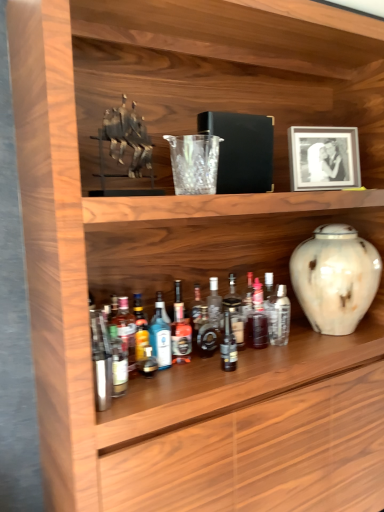
Question: In which direction should I rotate to look at translucent glass bottle at center, the 1th bottle when ordered from left to right?

Choices:
 (A) right
 (B) left

Answer: (B)

Question: Is the depth of white marbled vase at right greater than that of translucent glass bottle at center, placed as the 5th bottle when sorted from right to left?

Choices:
 (A) no
 (B) yes

Answer: (A)

Question: From a real-world perspective, is white marbled vase at right located higher than translucent glass bottle at center, the 3th bottle in the left-to-right sequence?

Choices:
 (A) yes
 (B) no

Answer: (A)

Question: Could you tell me if white marbled vase at right is turned towards translucent glass bottle at center, the 3th bottle in the left-to-right sequence?

Choices:
 (A) yes
 (B) no

Answer: (B)

Question: From a real-world perspective, is white marbled vase at right positioned under translucent glass bottle at center, placed as the 5th bottle when sorted from right to left, based on gravity?

Choices:
 (A) no
 (B) yes

Answer: (A)

Question: Does white marbled vase at right appear on the right side of translucent glass bottle at center, placed as the 5th bottle when sorted from right to left?

Choices:
 (A) no
 (B) yes

Answer: (B)

Question: Does white marbled vase at right have a lesser width compared to translucent glass bottle at center, placed as the 5th bottle when sorted from right to left?

Choices:
 (A) yes
 (B) no

Answer: (B)

Question: Is shiny dark glass bottle at center, the 4th bottle positioned from the left, thinner than white marbled vase at right?

Choices:
 (A) yes
 (B) no

Answer: (A)

Question: From a real-world perspective, is shiny dark glass bottle at center, which is the fourth bottle from right to left, physically below white marbled vase at right?

Choices:
 (A) no
 (B) yes

Answer: (B)

Question: Considering the relative sizes of shiny dark glass bottle at center, the 4th bottle positioned from the left, and white marbled vase at right in the image provided, is shiny dark glass bottle at center, the 4th bottle positioned from the left, wider than white marbled vase at right?

Choices:
 (A) no
 (B) yes

Answer: (A)

Question: Is shiny dark glass bottle at center, which is the fourth bottle from right to left, further to the viewer compared to white marbled vase at right?

Choices:
 (A) yes
 (B) no

Answer: (B)

Question: Does shiny dark glass bottle at center, which is the fourth bottle from right to left, have a smaller size compared to white marbled vase at right?

Choices:
 (A) no
 (B) yes

Answer: (B)

Question: Are shiny dark glass bottle at center, the 4th bottle positioned from the left, and white marbled vase at right located far from each other?

Choices:
 (A) yes
 (B) no

Answer: (B)

Question: From a real-world perspective, is translucent glass bottle at center, which appears as the seventh bottle when viewed from the right, beneath translucent glass bottle at center, the sixth bottle when ordered from left to right?

Choices:
 (A) no
 (B) yes

Answer: (B)